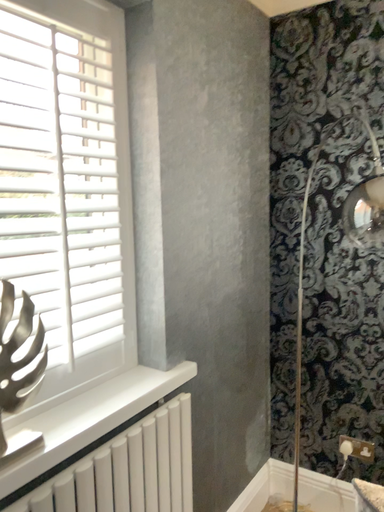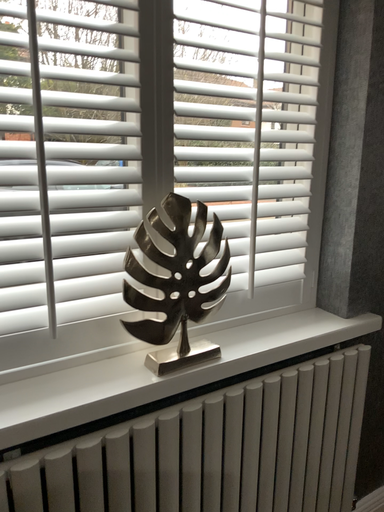
Question: How did the camera likely rotate when shooting the video?

Choices:
 (A) rotated left
 (B) rotated right

Answer: (A)